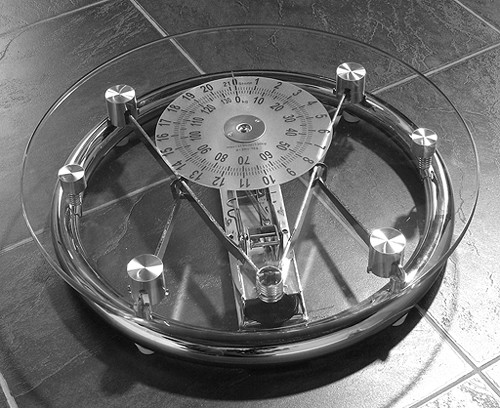
This screenshot has height=408, width=500. I want to click on black floor, so click(x=45, y=330), click(x=52, y=69), click(x=229, y=14).